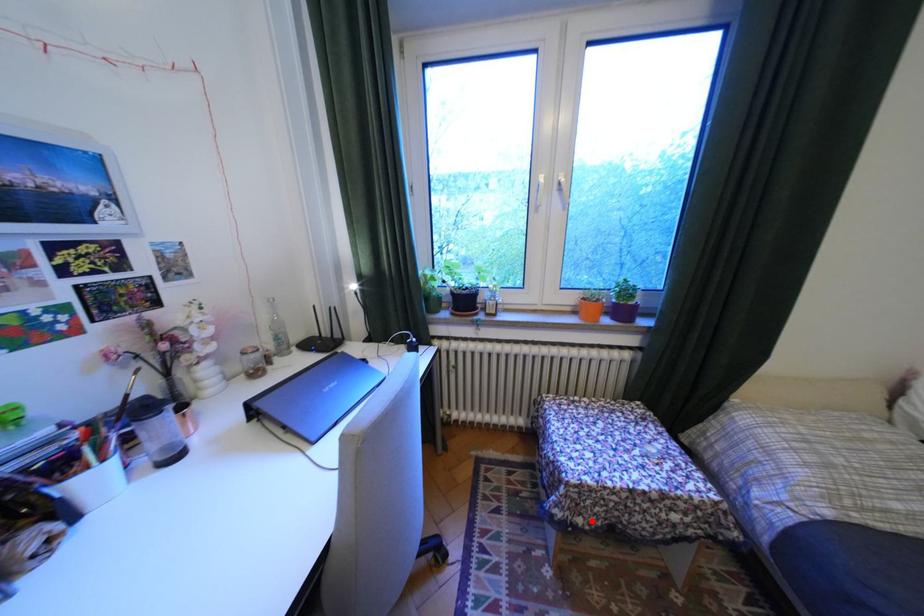
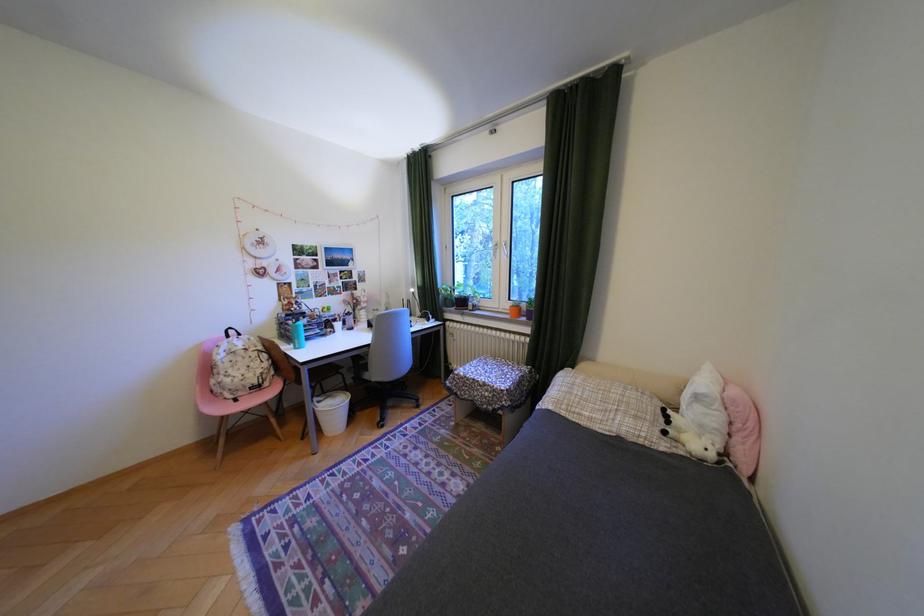
Question: I am providing you with two images of the same scene from different viewpoints. A red point is shown in image1. For the corresponding object point in image2, is it positioned nearer or farther from the camera?

Choices:
 (A) Nearer
 (B) Farther

Answer: (B)